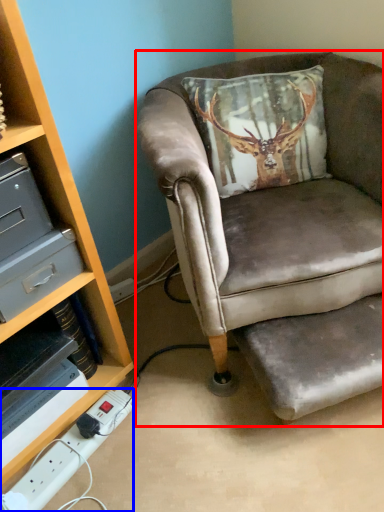
Question: Which of the following is the closest to the observer, chair (highlighted by a red box) or power outlet (highlighted by a blue box)?

Choices:
 (A) chair
 (B) power outlet

Answer: (A)